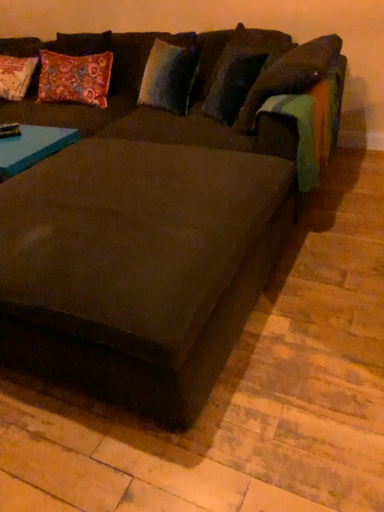
Question: Considering the relative positions of suede-like dark brown couch at center and velvety blue pillow at upper center, positioned as the 1th pillow in left-to-right order, in the image provided, is suede-like dark brown couch at center to the left of velvety blue pillow at upper center, positioned as the 1th pillow in left-to-right order, from the viewer's perspective?

Choices:
 (A) no
 (B) yes

Answer: (B)

Question: Is suede-like dark brown couch at center oriented away from velvety blue pillow at upper center, positioned as the 1th pillow in left-to-right order?

Choices:
 (A) yes
 (B) no

Answer: (A)

Question: From a real-world perspective, is suede-like dark brown couch at center over velvety blue pillow at upper center, arranged as the second pillow when viewed from the right?

Choices:
 (A) no
 (B) yes

Answer: (A)

Question: Considering the relative sizes of suede-like dark brown couch at center and velvety blue pillow at upper center, arranged as the second pillow when viewed from the right, in the image provided, is suede-like dark brown couch at center thinner than velvety blue pillow at upper center, arranged as the second pillow when viewed from the right,?

Choices:
 (A) no
 (B) yes

Answer: (A)

Question: From a real-world perspective, is suede-like dark brown couch at center below velvety blue pillow at upper center, positioned as the 1th pillow in left-to-right order?

Choices:
 (A) no
 (B) yes

Answer: (B)

Question: Is velvety brown pillow at upper right, which ranks as the second pillow in left-to-right order, wider or thinner than suede-like dark brown couch at center?

Choices:
 (A) thin
 (B) wide

Answer: (A)

Question: In terms of size, does velvety brown pillow at upper right, the 1th pillow from the right, appear bigger or smaller than suede-like dark brown couch at center?

Choices:
 (A) small
 (B) big

Answer: (A)

Question: From the image's perspective, is velvety brown pillow at upper right, which ranks as the second pillow in left-to-right order, positioned above or below suede-like dark brown couch at center?

Choices:
 (A) below
 (B) above

Answer: (B)

Question: From a real-world perspective, relative to suede-like dark brown couch at center, is velvety brown pillow at upper right, which ranks as the second pillow in left-to-right order, vertically above or below?

Choices:
 (A) below
 (B) above

Answer: (B)

Question: In the image, is velvety blue pillow at upper center, arranged as the second pillow when viewed from the right, on the left side or the right side of velvety brown pillow at upper right, which ranks as the second pillow in left-to-right order?

Choices:
 (A) left
 (B) right

Answer: (A)

Question: Considering the positions of velvety blue pillow at upper center, arranged as the second pillow when viewed from the right, and velvety brown pillow at upper right, the 1th pillow from the right, in the image, is velvety blue pillow at upper center, arranged as the second pillow when viewed from the right, bigger or smaller than velvety brown pillow at upper right, the 1th pillow from the right,?

Choices:
 (A) big
 (B) small

Answer: (B)

Question: Considering the positions of point (153, 68) and point (208, 89), is point (153, 68) closer or farther from the camera than point (208, 89)?

Choices:
 (A) farther
 (B) closer

Answer: (B)

Question: From their relative heights in the image, would you say velvety blue pillow at upper center, arranged as the second pillow when viewed from the right, is taller or shorter than velvety brown pillow at upper right, the 1th pillow from the right?

Choices:
 (A) tall
 (B) short

Answer: (B)

Question: Considering the positions of suede-like dark brown couch at center and velvety blue pillow at upper center, positioned as the 1th pillow in left-to-right order, in the image, is suede-like dark brown couch at center wider or thinner than velvety blue pillow at upper center, positioned as the 1th pillow in left-to-right order,?

Choices:
 (A) wide
 (B) thin

Answer: (A)

Question: Is suede-like dark brown couch at center bigger or smaller than velvety blue pillow at upper center, positioned as the 1th pillow in left-to-right order?

Choices:
 (A) big
 (B) small

Answer: (A)